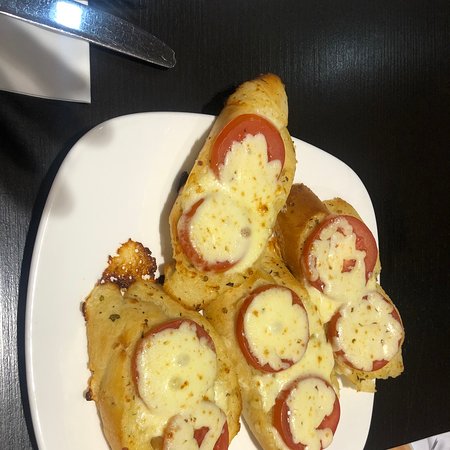
Identify the location of table. The height and width of the screenshot is (450, 450). (426, 379), (409, 251), (11, 216), (8, 379), (344, 46).